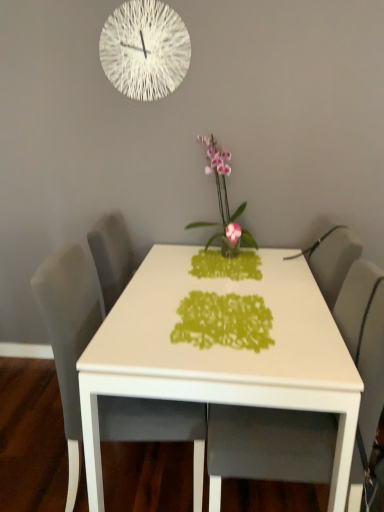
Question: Is green paper cutout at center aimed at white glossy table at center?

Choices:
 (A) no
 (B) yes

Answer: (B)

Question: Can you confirm if green paper cutout at center is wider than white glossy table at center?

Choices:
 (A) no
 (B) yes

Answer: (A)

Question: From a real-world perspective, is green paper cutout at center located higher than white glossy table at center?

Choices:
 (A) no
 (B) yes

Answer: (B)

Question: Is green paper cutout at center not within white glossy table at center?

Choices:
 (A) yes
 (B) no

Answer: (B)

Question: From a real-world perspective, is green paper cutout at center positioned under white glossy table at center based on gravity?

Choices:
 (A) yes
 (B) no

Answer: (B)

Question: Is gray fabric chair at center, which ranks as the 1th chair in right-to-left order, bigger or smaller than white glossy table at center?

Choices:
 (A) big
 (B) small

Answer: (B)

Question: Choose the correct answer: Is gray fabric chair at center, which ranks as the 1th chair in right-to-left order, inside white glossy table at center or outside it?

Choices:
 (A) outside
 (B) inside

Answer: (B)

Question: Is gray fabric chair at center, which ranks as the 1th chair in right-to-left order, to the left or to the right of white glossy table at center in the image?

Choices:
 (A) left
 (B) right

Answer: (B)

Question: Is gray fabric chair at center, which ranks as the 2th chair in left-to-right order, wider or thinner than white glossy table at center?

Choices:
 (A) thin
 (B) wide

Answer: (A)

Question: Visually, is white textured clock at upper center positioned to the left or to the right of green paper cutout at center?

Choices:
 (A) right
 (B) left

Answer: (B)

Question: Is point (150, 1) positioned closer to the camera than point (259, 329)?

Choices:
 (A) farther
 (B) closer

Answer: (A)

Question: In terms of width, does white textured clock at upper center look wider or thinner when compared to green paper cutout at center?

Choices:
 (A) wide
 (B) thin

Answer: (B)

Question: From a real-world perspective, is white textured clock at upper center above or below green paper cutout at center?

Choices:
 (A) below
 (B) above

Answer: (B)

Question: From a real-world perspective, is white glossy table at center physically located above or below green paper cutout at center?

Choices:
 (A) below
 (B) above

Answer: (A)

Question: Considering the relative positions of white glossy table at center and green paper cutout at center in the image provided, is white glossy table at center to the left or to the right of green paper cutout at center?

Choices:
 (A) right
 (B) left

Answer: (A)